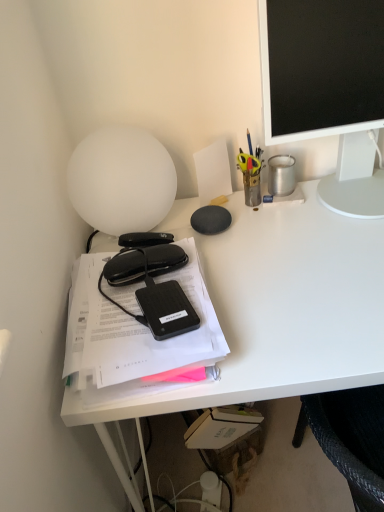
Question: Is black matte hardcover at left inside the boundaries of white plastic bottle at lower center, marked as the 2th stationery in a left-to-right arrangement, or outside?

Choices:
 (A) outside
 (B) inside

Answer: (A)

Question: Is black matte hardcover at left in front of or behind white plastic bottle at lower center, positioned as the 1th stationery in bottom-to-top order, in the image?

Choices:
 (A) behind
 (B) front

Answer: (B)

Question: Which object is positioned farthest from the black plastic external hard drive at center?

Choices:
 (A) black matte hardcover at left
 (B) white matte desk at left
 (C) white matte lamp at upper left
 (D) metallic silver pen holder at upper right, which ranks as the 2th stationery in back-to-front order
 (E) matte black monitor at upper right

Answer: (E)

Question: Based on their relative distances, which object is farther from the white matte lamp at upper left?

Choices:
 (A) matte black monitor at upper right
 (B) white matte desk at left
 (C) black matte hardcover at left
 (D) black plastic external hard drive at center
 (E) black matte glasses case at left, the 1th stationery in the front-to-back sequence

Answer: (A)